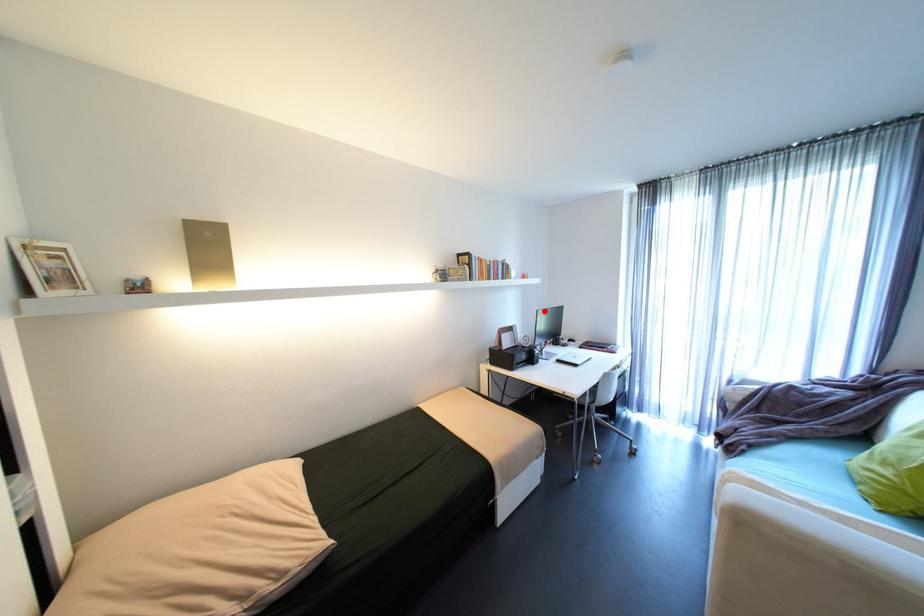
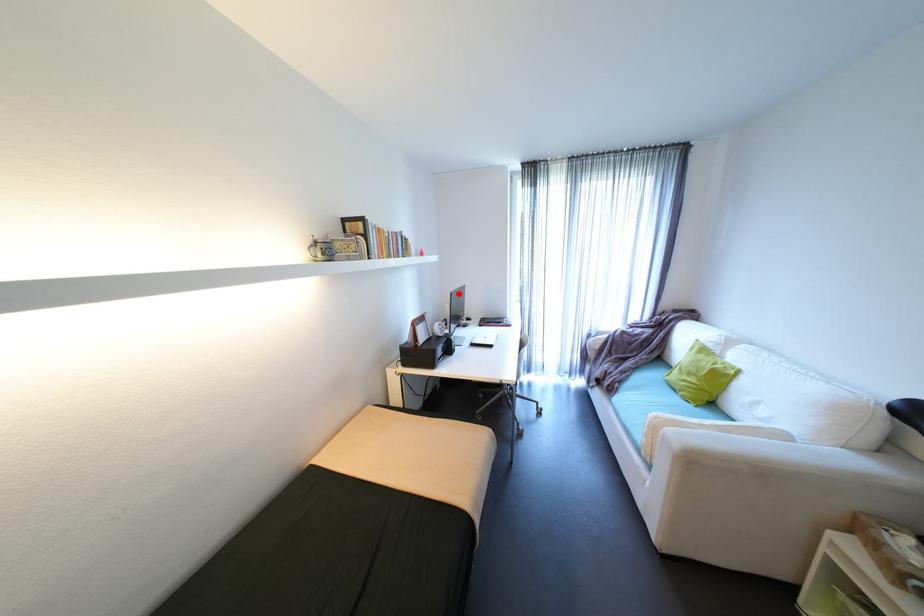
I am providing you with two images of the same scene from different viewpoints. A red point is marked on the first image and another point is marked on the second image. Are the points marked in image1 and image2 representing the same 3D position?

Yes